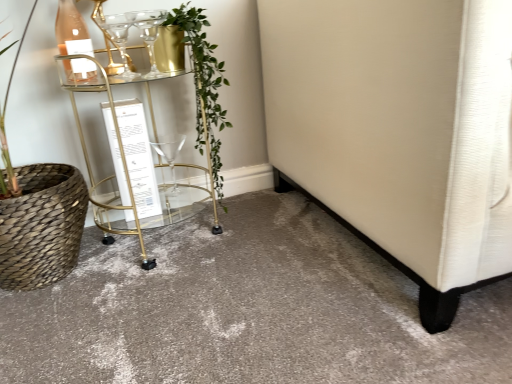
The height and width of the screenshot is (384, 512). What do you see at coordinates (119, 148) in the screenshot?
I see `gold metallic bar cart at center` at bounding box center [119, 148].

Locate an element on the screen. The height and width of the screenshot is (384, 512). green leafy plant at center is located at coordinates click(x=204, y=84).

Describe the element at coordinates (204, 84) in the screenshot. This screenshot has height=384, width=512. I see `green leafy plant at center` at that location.

Where is `carpeted floor at center`? The width and height of the screenshot is (512, 384). carpeted floor at center is located at coordinates (247, 310).

From the image's perspective, is carpeted floor at center above clear glass wine glass at center, acting as the 2th wine glass starting from the front?

No, from the image's perspective, carpeted floor at center is not above clear glass wine glass at center, acting as the 2th wine glass starting from the front.

Is carpeted floor at center located outside clear glass wine glass at center, the 1th wine glass viewed from the back?

carpeted floor at center lies outside clear glass wine glass at center, the 1th wine glass viewed from the back,'s area.

From a real-world perspective, is carpeted floor at center positioned over clear glass wine glass at center, acting as the 2th wine glass starting from the front, based on gravity?

No, from a real-world perspective, carpeted floor at center is not over clear glass wine glass at center, acting as the 2th wine glass starting from the front

In order to click on concrete to the right of clear glass wine glass at center, acting as the second wine glass starting from the top in this screenshot , I will do `click(247, 310)`.

Is clear glass wine glass at center, the 1th wine glass viewed from the back, to the left of carpeted floor at center from the viewer's perspective?

Correct, you'll find clear glass wine glass at center, the 1th wine glass viewed from the back, to the left of carpeted floor at center.

Which is closer to the camera, (172, 168) or (253, 292)?

Point (172, 168) is farther from the camera than point (253, 292).

Is clear glass wine glass at center, the 1th wine glass viewed from the back, facing away from carpeted floor at center?

No, clear glass wine glass at center, the 1th wine glass viewed from the back, is not facing away from carpeted floor at center.

Measure the distance from clear glass wine glass at upper left, positioned as the 2th wine glass in back-to-front order, to green leafy plant at center.

clear glass wine glass at upper left, positioned as the 2th wine glass in back-to-front order, and green leafy plant at center are 11.20 inches apart from each other.

Considering their positions, is clear glass wine glass at upper left, positioned as the 2th wine glass in back-to-front order, located in front of or behind green leafy plant at center?

Visually, clear glass wine glass at upper left, positioned as the 2th wine glass in back-to-front order, is located behind green leafy plant at center.

How different are the orientations of clear glass wine glass at upper left, the 2th wine glass from the bottom, and green leafy plant at center in degrees?

The angle between the facing direction of clear glass wine glass at upper left, the 2th wine glass from the bottom, and the facing direction of green leafy plant at center is 0.000874 degrees.

Considering the sizes of clear glass wine glass at upper left, the first wine glass in the front-to-back sequence, and green leafy plant at center in the image, is clear glass wine glass at upper left, the first wine glass in the front-to-back sequence, wider or thinner than green leafy plant at center?

clear glass wine glass at upper left, the first wine glass in the front-to-back sequence, is thinner than green leafy plant at center.

Locate an element on the screen. houseplant in front of the clear glass wine glass at center, acting as the second wine glass starting from the top is located at coordinates (204, 84).

From their relative heights in the image, would you say clear glass wine glass at center, acting as the 2th wine glass starting from the front, is taller or shorter than green leafy plant at center?

In the image, clear glass wine glass at center, acting as the 2th wine glass starting from the front, appears to be shorter than green leafy plant at center.

From a real-world perspective, relative to green leafy plant at center, is clear glass wine glass at center, the 1th wine glass viewed from the back, vertically above or below?

Clearly, from a real-world perspective, clear glass wine glass at center, the 1th wine glass viewed from the back, is below green leafy plant at center.

Does clear glass wine glass at upper left, the 2th wine glass from the bottom, have a larger size compared to clear glass wine glass at center, acting as the 2th wine glass starting from the front?

No, clear glass wine glass at upper left, the 2th wine glass from the bottom, is not bigger than clear glass wine glass at center, acting as the 2th wine glass starting from the front.

Which of these two, clear glass wine glass at upper left, the 1th wine glass when ordered from top to bottom, or clear glass wine glass at center, which is the first wine glass in bottom-to-top order, stands shorter?

Standing shorter between the two is clear glass wine glass at upper left, the 1th wine glass when ordered from top to bottom.

Which object is thinner, clear glass wine glass at upper left, the 2th wine glass from the bottom, or clear glass wine glass at center, acting as the 2th wine glass starting from the front?

clear glass wine glass at upper left, the 2th wine glass from the bottom, is thinner.

Is clear glass wine glass at upper left, the 1th wine glass when ordered from top to bottom, placed right next to clear glass wine glass at center, the 1th wine glass viewed from the back?

clear glass wine glass at upper left, the 1th wine glass when ordered from top to bottom, and clear glass wine glass at center, the 1th wine glass viewed from the back, are not in contact.

In the scene shown: From the image's perspective, who appears lower, clear glass wine glass at center, the 1th wine glass viewed from the back, or matte glass bottle at upper left?

clear glass wine glass at center, the 1th wine glass viewed from the back, is shown below in the image.

Consider the image. Is clear glass wine glass at center, which is the first wine glass in bottom-to-top order, surrounding matte glass bottle at upper left?

No, matte glass bottle at upper left is located outside of clear glass wine glass at center, which is the first wine glass in bottom-to-top order.

Considering the positions of objects clear glass wine glass at center, acting as the 2th wine glass starting from the front, and matte glass bottle at upper left in the image provided, who is more to the left, clear glass wine glass at center, acting as the 2th wine glass starting from the front, or matte glass bottle at upper left?

matte glass bottle at upper left.

Is clear glass wine glass at center, the 1th wine glass viewed from the back, shorter than matte glass bottle at upper left?

Yes.

Is clear glass wine glass at center, acting as the 2th wine glass starting from the front, not inside clear glass wine glass at upper left, the 1th wine glass when ordered from top to bottom?

Yes, clear glass wine glass at center, acting as the 2th wine glass starting from the front, is outside of clear glass wine glass at upper left, the 1th wine glass when ordered from top to bottom.

Image resolution: width=512 pixels, height=384 pixels. I want to click on wine glass that appears in front of the clear glass wine glass at center, acting as the second wine glass starting from the top, so click(x=120, y=40).

Can you see clear glass wine glass at center, acting as the 2th wine glass starting from the front, touching clear glass wine glass at upper left, the first wine glass in the front-to-back sequence?

There is a gap between clear glass wine glass at center, acting as the 2th wine glass starting from the front, and clear glass wine glass at upper left, the first wine glass in the front-to-back sequence.

Does clear glass wine glass at center, acting as the second wine glass starting from the top, have a larger size compared to clear glass wine glass at upper left, the 2th wine glass from the bottom?

Correct, clear glass wine glass at center, acting as the second wine glass starting from the top, is larger in size than clear glass wine glass at upper left, the 2th wine glass from the bottom.

I want to click on the 1st wine glass counting from the left side of the carpeted floor at center, so click(170, 157).

From a real-world perspective, which wine glass is the 1st one above the carpeted floor at center? Please provide its 2D coordinates.

[(170, 157)]

When comparing their distances from gold metallic bar cart at center, does green leafy plant at center or carpeted floor at center seem further?

The object further to gold metallic bar cart at center is carpeted floor at center.

Estimate the real-world distances between objects in this image. Which object is closer to clear glass wine glass at center, acting as the second wine glass starting from the top, clear glass wine glass at upper left, the first wine glass in the front-to-back sequence, or matte glass bottle at upper left?

Based on the image, clear glass wine glass at upper left, the first wine glass in the front-to-back sequence, appears to be nearer to clear glass wine glass at center, acting as the second wine glass starting from the top.

From the image, which object appears to be nearer to carpeted floor at center, green leafy plant at center or gold metallic bar cart at center?

The object closer to carpeted floor at center is gold metallic bar cart at center.

Which object lies nearer to the anchor point clear glass wine glass at center, acting as the 2th wine glass starting from the front, clear glass wine glass at upper left, positioned as the 2th wine glass in back-to-front order, or carpeted floor at center?

clear glass wine glass at upper left, positioned as the 2th wine glass in back-to-front order, lies closer to clear glass wine glass at center, acting as the 2th wine glass starting from the front, than the other object.

When comparing their distances from gold metallic bar cart at center, does clear glass wine glass at upper left, the 2th wine glass from the bottom, or clear glass wine glass at center, acting as the 2th wine glass starting from the front, seem further?

clear glass wine glass at upper left, the 2th wine glass from the bottom, lies further to gold metallic bar cart at center than the other object.

Which object lies further to the anchor point matte glass bottle at upper left, clear glass wine glass at upper left, the 2th wine glass from the bottom, or green leafy plant at center?

The object further to matte glass bottle at upper left is green leafy plant at center.

When comparing their distances from clear glass wine glass at center, acting as the 2th wine glass starting from the front, does matte glass bottle at upper left or clear glass wine glass at upper left, the 1th wine glass when ordered from top to bottom, seem closer?

clear glass wine glass at upper left, the 1th wine glass when ordered from top to bottom.

Which object lies further to the anchor point carpeted floor at center, clear glass wine glass at center, the 1th wine glass viewed from the back, or clear glass wine glass at upper left, the 1th wine glass when ordered from top to bottom?

clear glass wine glass at upper left, the 1th wine glass when ordered from top to bottom.

In order to click on houseplant between carpeted floor at center and clear glass wine glass at upper left, positioned as the 2th wine glass in back-to-front order, in the front-back direction in this screenshot , I will do `click(204, 84)`.

At what (x,y) coordinates should I click in order to perform the action: click on houseplant that lies between matte glass bottle at upper left and gold metallic bar cart at center from top to bottom. Please return your answer as a coordinate pair (x, y). The height and width of the screenshot is (384, 512). Looking at the image, I should click on (204, 84).

Where is `wine glass between matte glass bottle at upper left and clear glass wine glass at center, acting as the second wine glass starting from the top, vertically`? Image resolution: width=512 pixels, height=384 pixels. wine glass between matte glass bottle at upper left and clear glass wine glass at center, acting as the second wine glass starting from the top, vertically is located at coordinates (120, 40).

Locate an element on the screen. This screenshot has height=384, width=512. wine glass between carpeted floor at center and clear glass wine glass at center, which is the first wine glass in bottom-to-top order, in the front-back direction is located at coordinates (120, 40).